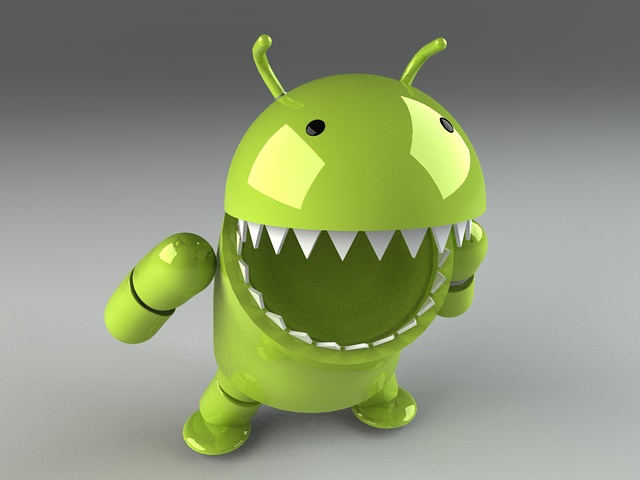
Where is `glare from light`? The width and height of the screenshot is (640, 480). glare from light is located at coordinates (292, 154), (420, 145).